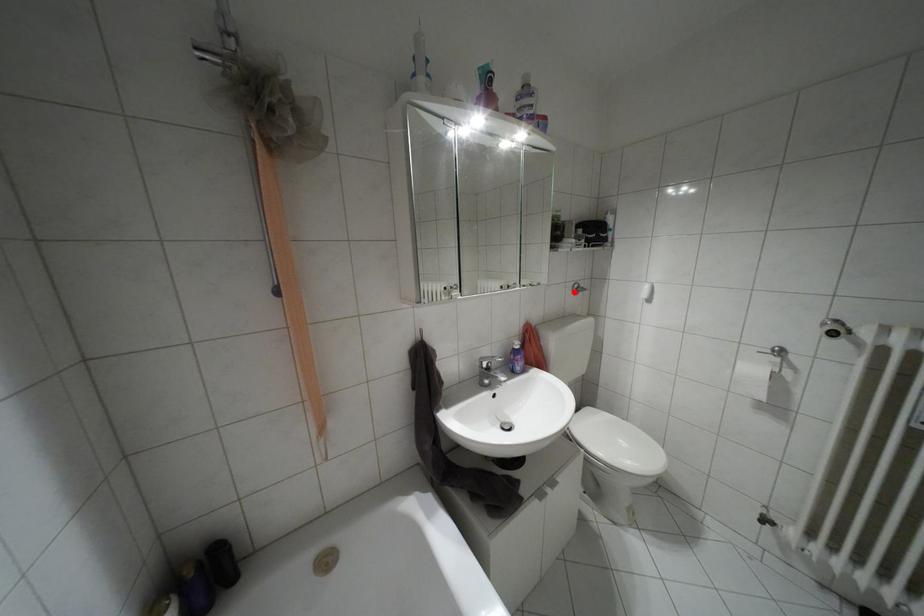
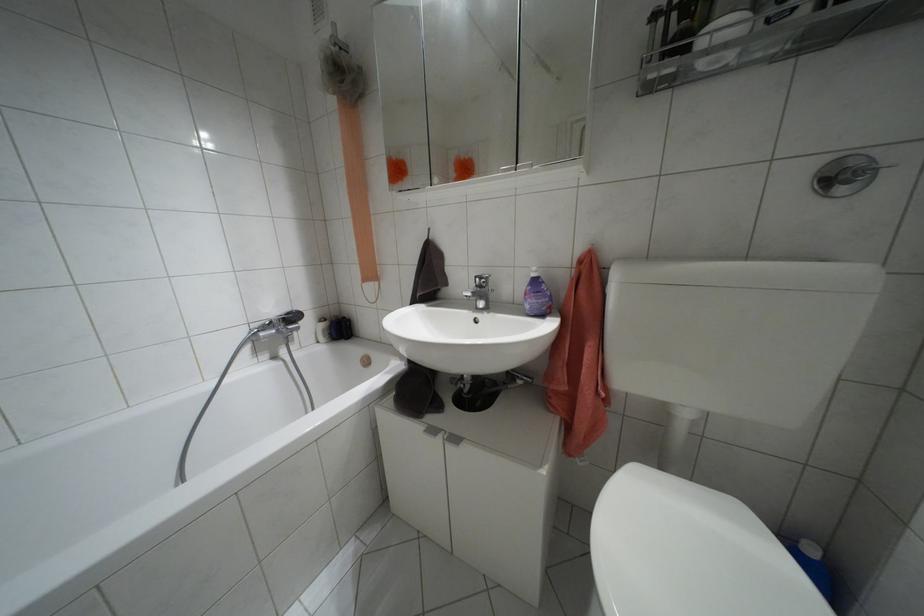
The point at the highlighted location is marked in the first image. Where is the corresponding point in the second image?

(841, 190)